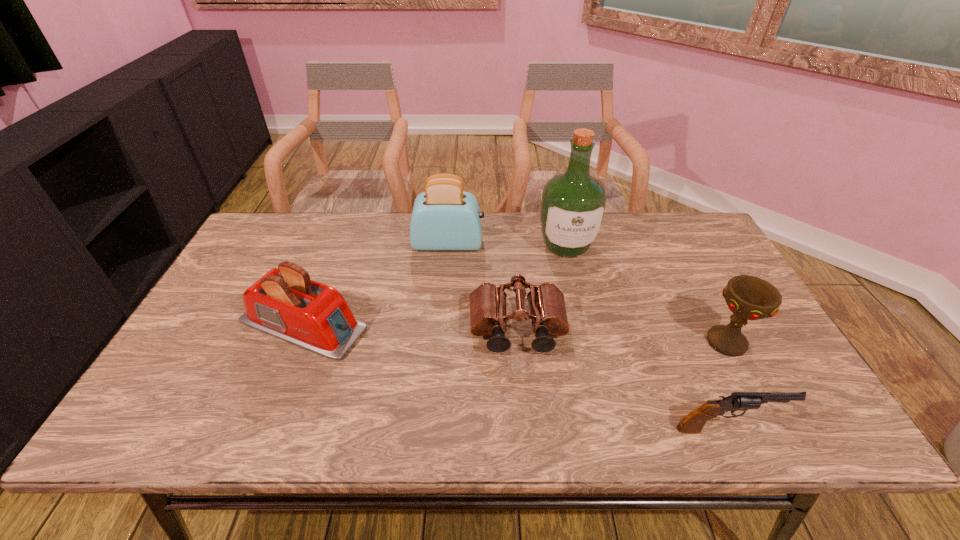
Locate an element on the screen. vacant area that lies between the chalice and the nearest object is located at coordinates (727, 385).

The image size is (960, 540). I want to click on vacant space that is in between the chalice and the nearest object, so click(727, 385).

Identify the location of blank region between the second tallest object and the nearest object. (588, 336).

This screenshot has height=540, width=960. In order to click on object identified as the third closest to the nearer toaster in this screenshot , I will do click(573, 205).

The height and width of the screenshot is (540, 960). Identify the location of object that is the third closest to the gun. (573, 205).

Locate an element on the screen. The image size is (960, 540). vacant area in the image that satisfies the following two spatial constraints: 1. on the side of the taller toaster with the lever; 2. on the right side of the chalice is located at coordinates (440, 342).

You are a GUI agent. You are given a task and a screenshot of the screen. Output one action in this format:
    pyautogui.click(x=<x>, y=<y>)
    Task: Click on the vacant position in the image that satisfies the following two spatial constraints: 1. through the eyepieces of the binoculars; 2. on the right side of the chalice
    This screenshot has height=540, width=960.
    Given the screenshot: What is the action you would take?
    pyautogui.click(x=518, y=342)

I want to click on vacant space that satisfies the following two spatial constraints: 1. on the front-facing side of the chalice; 2. on the right side of the liquor, so click(588, 342).

Find the location of `free space that satisfies the following two spatial constraints: 1. on the side of the chalice with the lever; 2. on the left side of the fifth shortest object`. free space that satisfies the following two spatial constraints: 1. on the side of the chalice with the lever; 2. on the left side of the fifth shortest object is located at coordinates (440, 342).